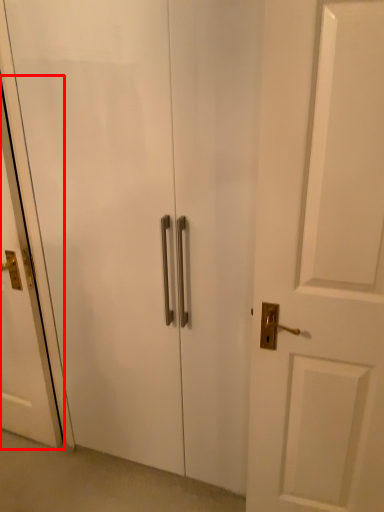
Question: Considering the relative positions of screen door (annotated by the red box) and elevator in the image provided, where is screen door (annotated by the red box) located with respect to the staircase?

Choices:
 (A) left
 (B) right

Answer: (A)